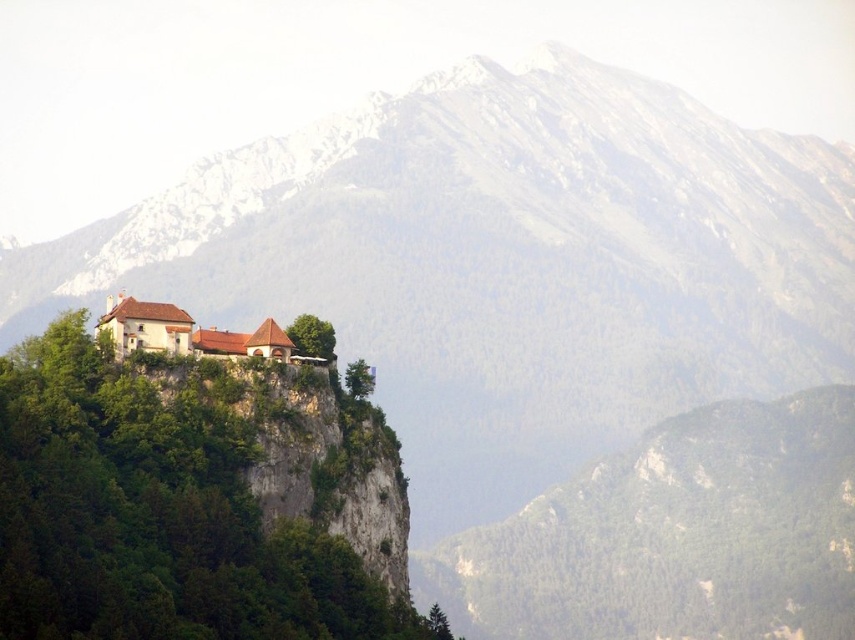
You are an architect planning to build a new observation deck. You need to ensure it has a clear view of the castle and the mountain range. Given the green forested hill at center, where should you position the observation deck to avoid obstruction?

The green forested hill at center is located at point (675,536), so positioning the observation deck above or to the sides of this coordinate would provide an unobstructed view of the castle and the mountain range.

You are an architect planning to build a new observation deck. You notice the green forested hill at center and the white stone building at center in the image. Which of these two would require more careful consideration regarding its size when designing the deck to ensure proper proportions?

The green forested hill at center is bigger than the white stone building at center, so the green forested hill at center would require more careful consideration regarding its size when designing the deck to ensure proper proportions.

You are an architect planning to build a new observation deck. You need to choose between placing it on the green forested hill at center or the white stone building at center. Which location offers more horizontal space for the deck?

The green forested hill at center has a greater width than the white stone building at center, so it offers more horizontal space for the observation deck.